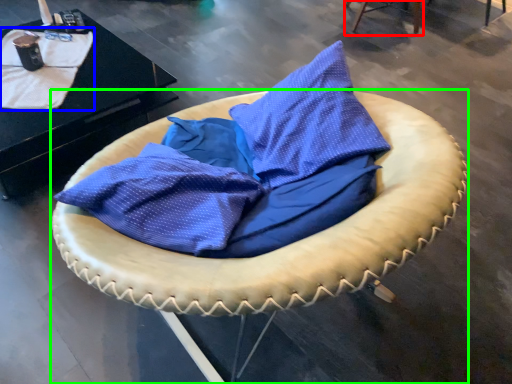
Question: Which object is the farthest from furniture (highlighted by a red box)? Choose among these: blanket (highlighted by a blue box) or furniture (highlighted by a green box).

Choices:
 (A) blanket
 (B) furniture

Answer: (B)